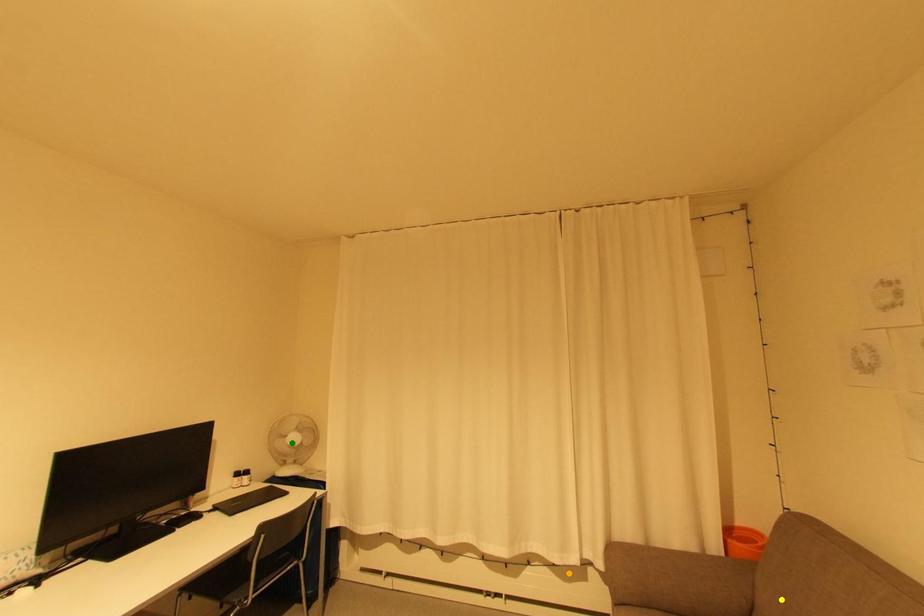
Order these from farthest to nearest:
- orange point
- yellow point
- green point

green point < orange point < yellow point